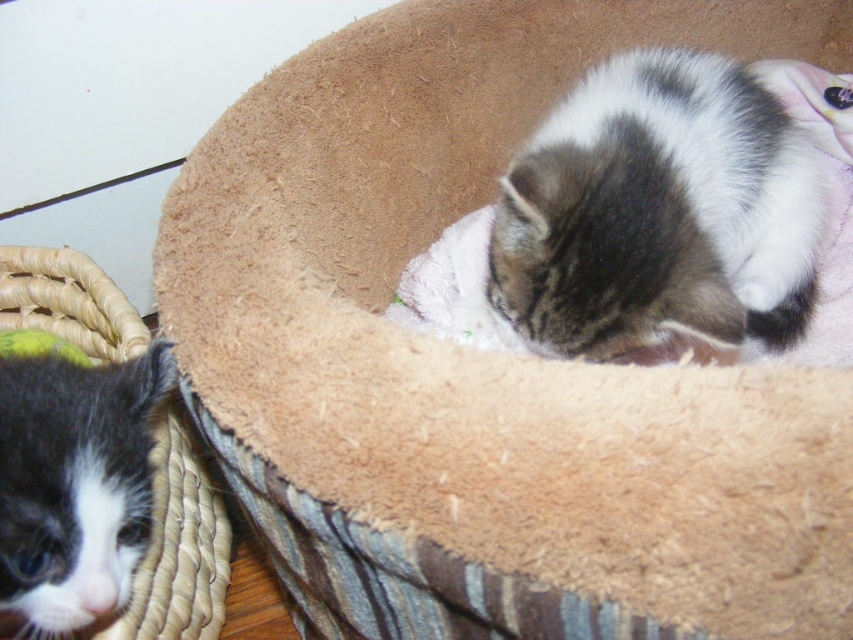
Question: Does tabby fur cat at upper right have a greater width compared to black and white fur at left?

Choices:
 (A) yes
 (B) no

Answer: (A)

Question: Is tabby fur cat at upper right above black and white fur at left?

Choices:
 (A) no
 (B) yes

Answer: (B)

Question: Which of the following is the farthest from the observer?

Choices:
 (A) black and white fur at left
 (B) tabby fur cat at upper right

Answer: (B)

Question: Considering the relative positions of tabby fur cat at upper right and black and white fur at left in the image provided, where is tabby fur cat at upper right located with respect to black and white fur at left?

Choices:
 (A) left
 (B) right

Answer: (B)